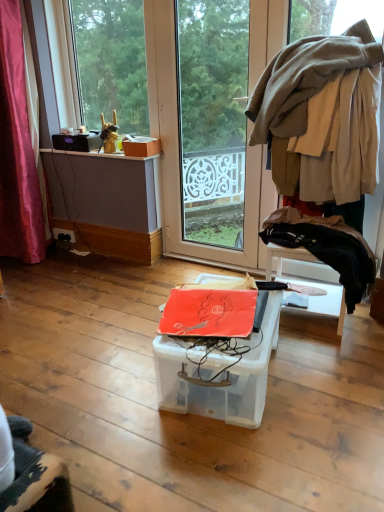
Question: From a real-world perspective, is transparent glass screen door at center positioned over transparent glass window at upper left based on gravity?

Choices:
 (A) yes
 (B) no

Answer: (B)

Question: Considering the relative positions of transparent glass screen door at center and transparent glass window at upper left in the image provided, is transparent glass screen door at center to the left of transparent glass window at upper left from the viewer's perspective?

Choices:
 (A) no
 (B) yes

Answer: (A)

Question: From the image's perspective, does transparent glass screen door at center appear lower than transparent glass window at upper left?

Choices:
 (A) yes
 (B) no

Answer: (A)

Question: From a real-world perspective, is transparent glass screen door at center beneath transparent glass window at upper left?

Choices:
 (A) no
 (B) yes

Answer: (B)

Question: Is transparent glass screen door at center facing away from transparent glass window at upper left?

Choices:
 (A) yes
 (B) no

Answer: (B)

Question: Is transparent glass screen door at center at the right side of transparent glass window at upper left?

Choices:
 (A) yes
 (B) no

Answer: (A)

Question: From the image's perspective, is beige woolen sweater at upper right, acting as the 2th clothing starting from the bottom, over transparent glass screen door at center?

Choices:
 (A) yes
 (B) no

Answer: (A)

Question: Is beige woolen sweater at upper right, which is counted as the first clothing, starting from the top, taller than transparent glass screen door at center?

Choices:
 (A) no
 (B) yes

Answer: (A)

Question: Is beige woolen sweater at upper right, which is counted as the first clothing, starting from the top, wider than transparent glass screen door at center?

Choices:
 (A) no
 (B) yes

Answer: (B)

Question: From a real-world perspective, is beige woolen sweater at upper right, acting as the 2th clothing starting from the bottom, on transparent glass screen door at center?

Choices:
 (A) no
 (B) yes

Answer: (B)

Question: Can you confirm if beige woolen sweater at upper right, which is counted as the first clothing, starting from the top, is positioned to the left of transparent glass screen door at center?

Choices:
 (A) yes
 (B) no

Answer: (B)

Question: From the image's perspective, is beige woolen sweater at upper right, acting as the 2th clothing starting from the bottom, beneath transparent glass screen door at center?

Choices:
 (A) no
 (B) yes

Answer: (A)

Question: From the image's perspective, would you say beige woolen sweater at upper right, acting as the 2th clothing starting from the bottom, is shown under black fabric at right, which is the 1th clothing from bottom to top?

Choices:
 (A) yes
 (B) no

Answer: (B)